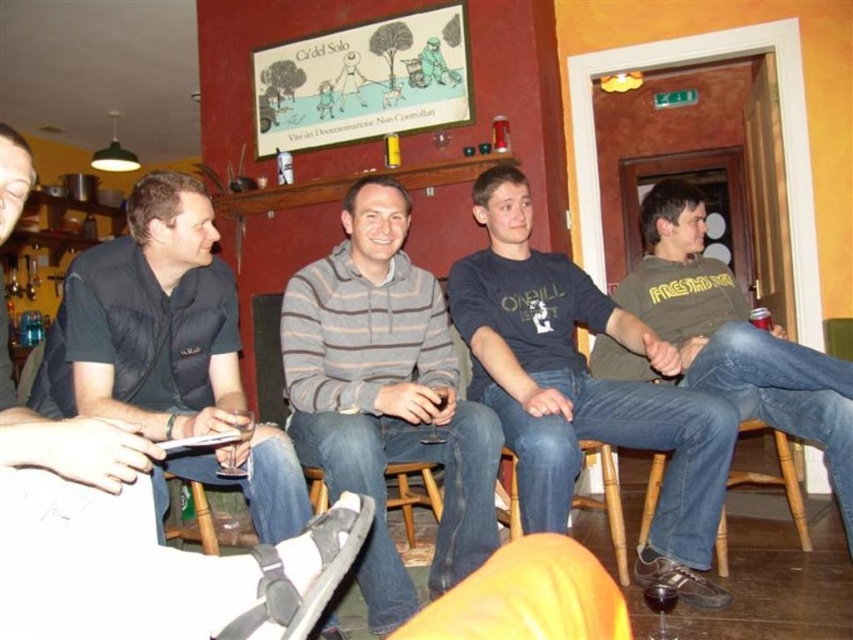
You are a photographer trying to capture a photo of the gray striped sweater at center and the brown wooden stool at lower right. Which object is located to the left of the other?

The gray striped sweater at center is positioned on the left side of brown wooden stool at lower right.

You are a photographer trying to capture a candid shot of the group without any obstructions. You notice the yellow leather jacket at lower center and the wooden stool at lower center in the frame. Which object should you avoid placing in front of the group to ensure a clear view?

The yellow leather jacket at lower center is not as tall as the wooden stool at lower center, so the wooden stool at lower center is taller and would obstruct the view more. To ensure a clear view, you should avoid placing the wooden stool at lower center in front of the group.